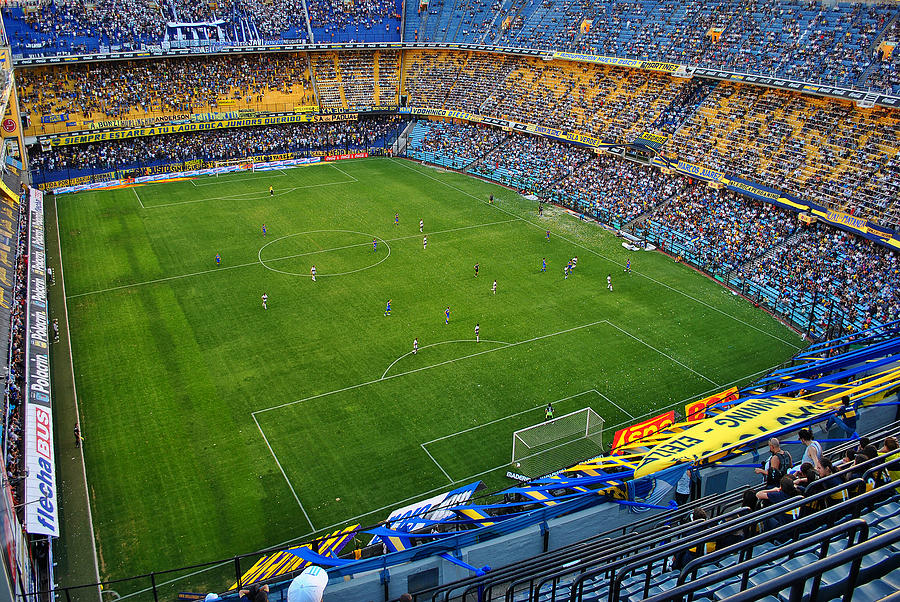
Where is `audience chairs`? Image resolution: width=900 pixels, height=602 pixels. audience chairs is located at coordinates (776, 572), (824, 559).